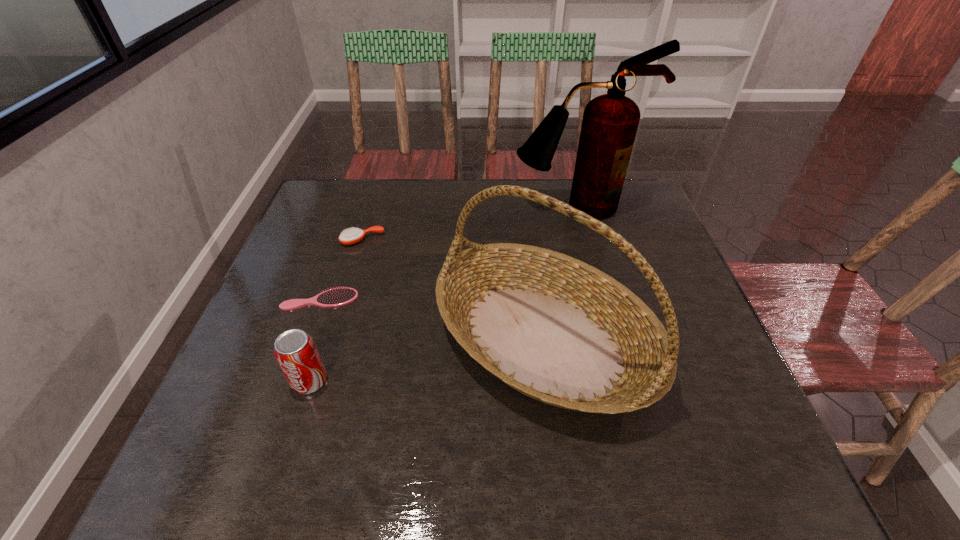
Where is `blank space at the far edge`? The width and height of the screenshot is (960, 540). blank space at the far edge is located at coordinates (418, 186).

Find the location of a particular element. The height and width of the screenshot is (540, 960). free space at the left edge of the desktop is located at coordinates (219, 396).

Identify the location of vacant area at the right edge. The image size is (960, 540). click(728, 407).

In the image, there is a desktop. Identify the location of vacant area at the far left corner. This screenshot has height=540, width=960. (359, 198).

In the image, there is a desktop. In order to click on vacant region at the near left corner in this screenshot , I will do `click(217, 484)`.

You are a GUI agent. You are given a task and a screenshot of the screen. Output one action in this format:
    pyautogui.click(x=<x>, y=<y>)
    Task: Click on the free space at the far right corner of the desktop
    
    Given the screenshot: What is the action you would take?
    pyautogui.click(x=638, y=198)

Locate an element on the screen. This screenshot has height=540, width=960. vacant point located between the shorter hairbrush and the soda can is located at coordinates (315, 340).

The width and height of the screenshot is (960, 540). Identify the location of free space between the soda can and the fourth nearest object. (336, 310).

The image size is (960, 540). Find the location of `free space that is in between the farthest object and the fourth tallest object`. free space that is in between the farthest object and the fourth tallest object is located at coordinates (468, 223).

The image size is (960, 540). Find the location of `empty location between the second tallest object and the shorter hairbrush`. empty location between the second tallest object and the shorter hairbrush is located at coordinates (432, 319).